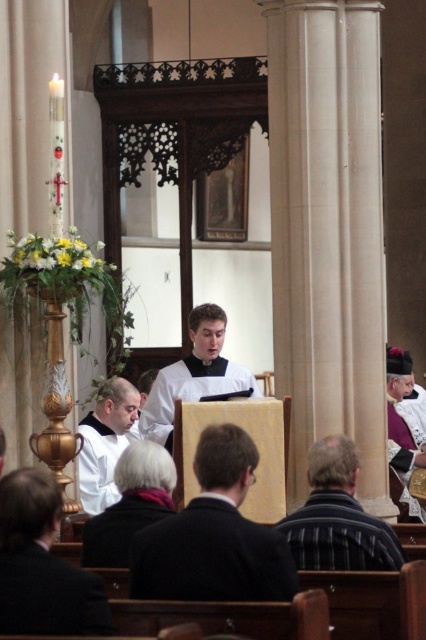
Is point (330, 468) more distant than point (121, 493)?

Yes, it is behind point (121, 493).

Who is taller, striped fabric shirt at lower center or dark gray woolen robe at lower center?

Standing taller between the two is striped fabric shirt at lower center.

The width and height of the screenshot is (426, 640). What are the coordinates of `striped fabric shirt at lower center` in the screenshot? It's located at (337, 516).

Does point (14, 598) come in front of point (193, 378)?

Yes, point (14, 598) is closer to viewer.

Which is behind, point (71, 618) or point (195, 314)?

Positioned behind is point (195, 314).

Where is `dark woolen robe at lower center`? This screenshot has height=640, width=426. dark woolen robe at lower center is located at coordinates (49, 595).

Is dark suit at center bigger than dark gray woolen robe at lower center?

Correct, dark suit at center is larger in size than dark gray woolen robe at lower center.

Is dark suit at center thinner than dark gray woolen robe at lower center?

Incorrect, dark suit at center's width is not less than dark gray woolen robe at lower center's.

Describe the element at coordinates (215, 536) in the screenshot. Image resolution: width=426 pixels, height=640 pixels. I see `dark suit at center` at that location.

Where is `dark suit at center`? dark suit at center is located at coordinates (215, 536).